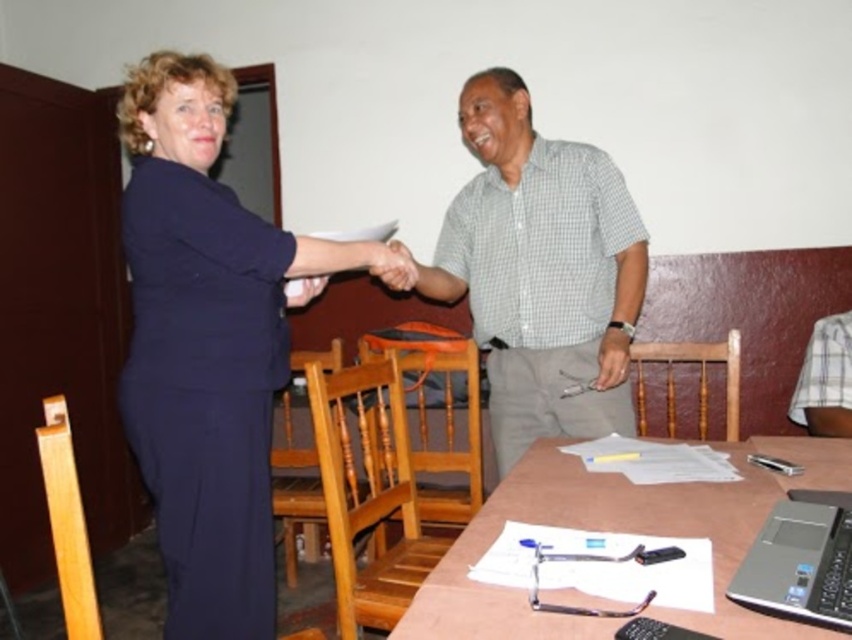
Question: Based on their relative distances, which object is nearer to the gray checkered shirt at center?

Choices:
 (A) silver/black plastic laptop at lower right
 (B) wooden table at center

Answer: (B)

Question: Which of the following is the closest to the observer?

Choices:
 (A) (501, 180)
 (B) (456, 541)
 (C) (847, 486)
 (D) (393, 264)

Answer: (B)

Question: Which point is closer to the camera?

Choices:
 (A) pyautogui.click(x=551, y=406)
 (B) pyautogui.click(x=187, y=552)
 (C) pyautogui.click(x=383, y=259)

Answer: (B)

Question: Observing the image, what is the correct spatial positioning of gray checkered shirt at center in reference to wooden table at center?

Choices:
 (A) right
 (B) left

Answer: (B)

Question: Can you confirm if gray checkered shirt at center is bigger than matte black hand at center?

Choices:
 (A) yes
 (B) no

Answer: (A)

Question: Is dark blue fabric dress at upper left smaller than matte black hand at center?

Choices:
 (A) no
 (B) yes

Answer: (A)